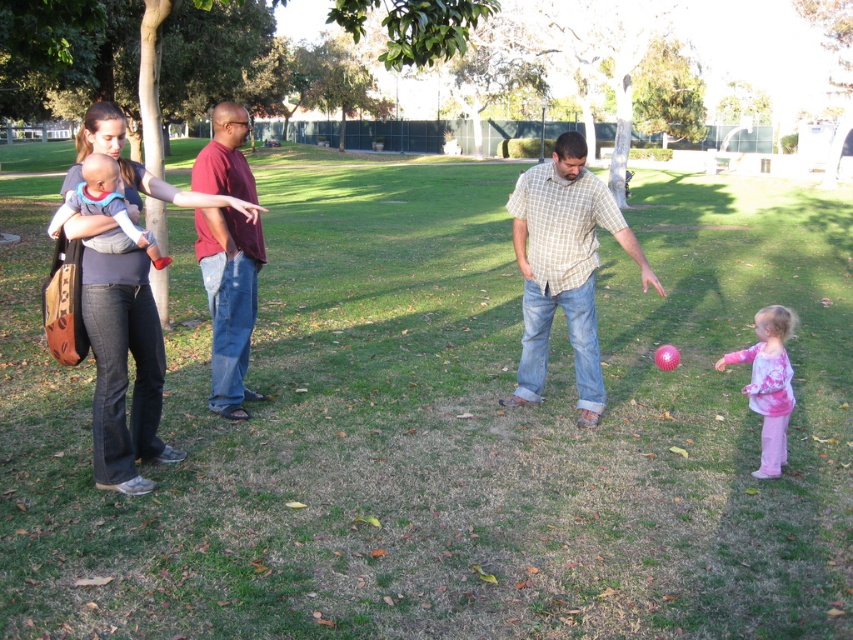
You are a photographer trying to capture a candid shot of the checkered shirt jeans at center without the matte black shirt at upper left blocking the view. Can you adjust your position to do so?

The matte black shirt at upper left is in front of the checkered shirt jeans at center, so moving your position to the side or behind the matte black shirt at upper left would allow you to capture the checkered shirt jeans at center without obstruction.